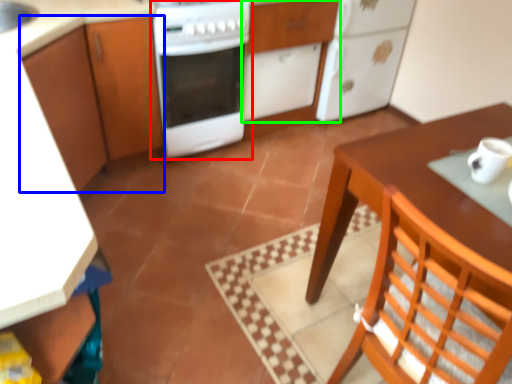
Question: Estimate the real-world distances between objects in this image. Which object is closer to home appliance (highlighted by a red box), cabinetry (highlighted by a blue box) or cabinetry (highlighted by a green box)?

Choices:
 (A) cabinetry
 (B) cabinetry

Answer: (A)